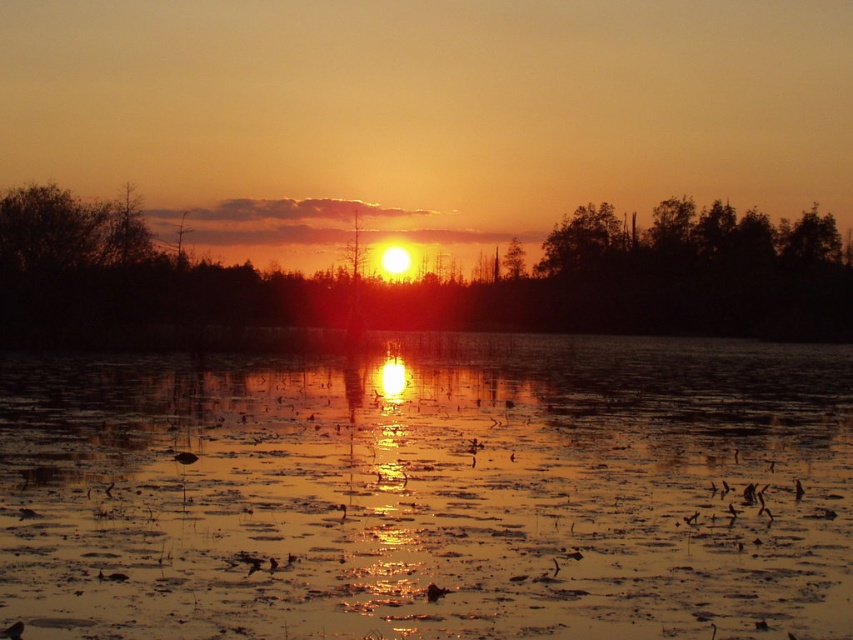
You are an artist trying to capture the sunset scene. You want to paint the golden reflective water at center and the green matte tree at upper right. Which object should you paint first if you follow the standard left to right painting technique?

You should paint the golden reflective water at center first because it is positioned on the left side of the green matte tree at upper right, following the left to right painting technique.

You are an artist trying to paint the sunset scene. You want to ensure the golden reflective water at center and the silhouette tree at center are placed correctly. According to the scene, which object should be on the right side of the other?

The golden reflective water at center is positioned on the right side of the silhouette tree at center.